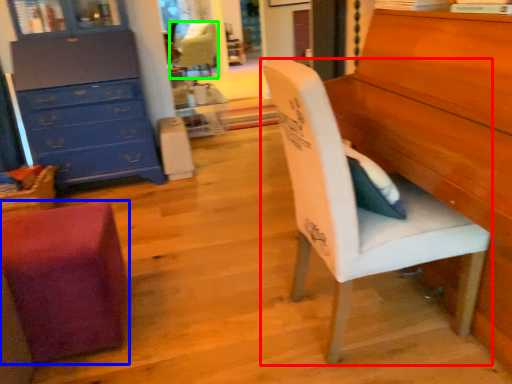
Question: Which object is the closest to the chair (highlighted by a red box)? Choose among these: chair (highlighted by a blue box) or chair (highlighted by a green box).

Choices:
 (A) chair
 (B) chair

Answer: (A)